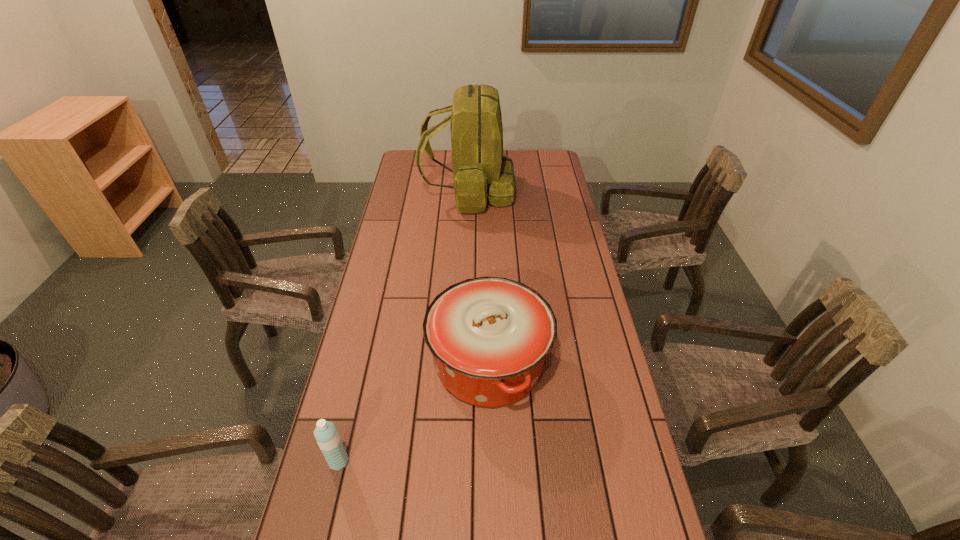
Where is `the tallest object`? the tallest object is located at coordinates (480, 171).

In order to click on the farthest object in this screenshot , I will do `click(480, 171)`.

You are a GUI agent. You are given a task and a screenshot of the screen. Output one action in this format:
    pyautogui.click(x=<x>, y=<y>)
    Task: Click on the second tallest object
    The image size is (960, 540).
    Given the screenshot: What is the action you would take?
    [x=490, y=336]

This screenshot has height=540, width=960. Find the location of `the second farthest object`. the second farthest object is located at coordinates (490, 336).

At what (x,y) coordinates should I click in order to perform the action: click on water bottle. Please return your answer as a coordinate pair (x, y). This screenshot has height=540, width=960. Looking at the image, I should click on (327, 437).

Where is `the leftmost object`? the leftmost object is located at coordinates (327, 437).

I want to click on vacant point located 0.050m on the front-facing side of the tallest object, so click(526, 192).

You are a GUI agent. You are given a task and a screenshot of the screen. Output one action in this format:
    pyautogui.click(x=<x>, y=<y>)
    Task: Click on the free spot located 0.170m on the right of the casserole
    Image resolution: width=960 pixels, height=540 pixels.
    Given the screenshot: What is the action you would take?
    pyautogui.click(x=612, y=363)

Where is `vacant space located 0.080m on the back of the leftmost object`? This screenshot has width=960, height=540. vacant space located 0.080m on the back of the leftmost object is located at coordinates (348, 421).

Identify the location of object that is at the far edge. (480, 171).